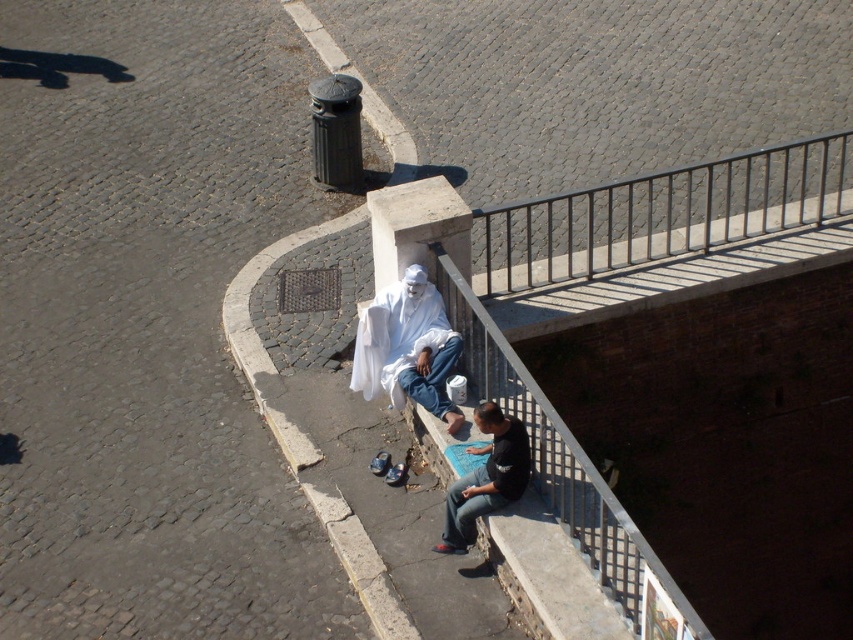
Who is more forward, (621, 180) or (462, 540)?

Positioned in front is point (462, 540).

Who is shorter, metallic silver rail at upper right or black cotton shirt at lower center?

black cotton shirt at lower center is shorter.

At what (x,y) coordinates should I click in order to perform the action: click on metallic silver rail at upper right. Please return your answer as a coordinate pair (x, y). Looking at the image, I should click on (660, 214).

Is white cloth at center thinner than black cotton shirt at lower center?

No.

Is white cloth at center smaller than black cotton shirt at lower center?

Incorrect, white cloth at center is not smaller in size than black cotton shirt at lower center.

This screenshot has width=853, height=640. What are the coordinates of `white cloth at center` in the screenshot? It's located at pos(407,348).

Which of these two, metallic silver rail at upper right or white cloth at center, stands taller?

With more height is metallic silver rail at upper right.

Does metallic silver rail at upper right appear under white cloth at center?

No.

The width and height of the screenshot is (853, 640). What do you see at coordinates (660, 214) in the screenshot?
I see `metallic silver rail at upper right` at bounding box center [660, 214].

You are a GUI agent. You are given a task and a screenshot of the screen. Output one action in this format:
    pyautogui.click(x=<x>, y=<y>)
    Task: Click on the metallic silver rail at upper right
    The width and height of the screenshot is (853, 640).
    Given the screenshot: What is the action you would take?
    pyautogui.click(x=660, y=214)